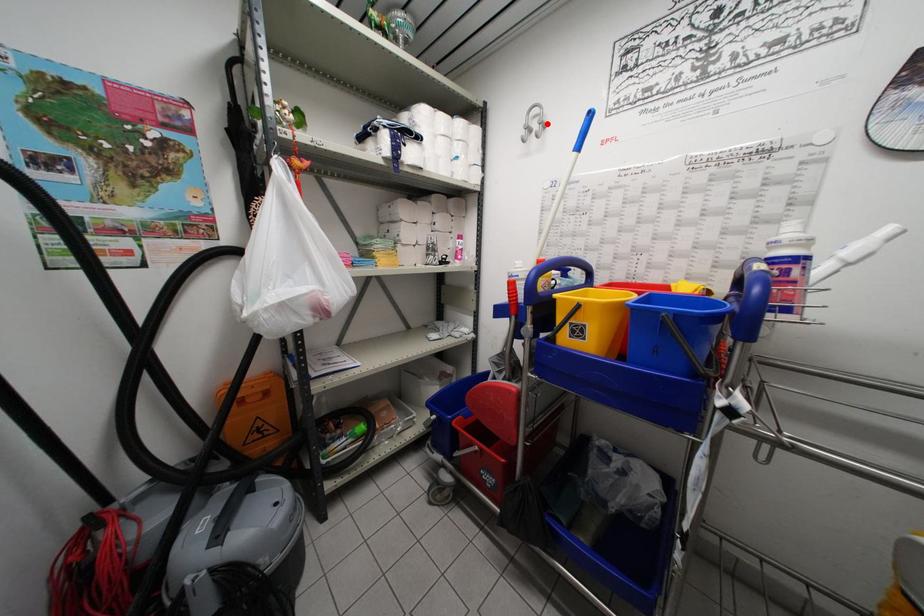
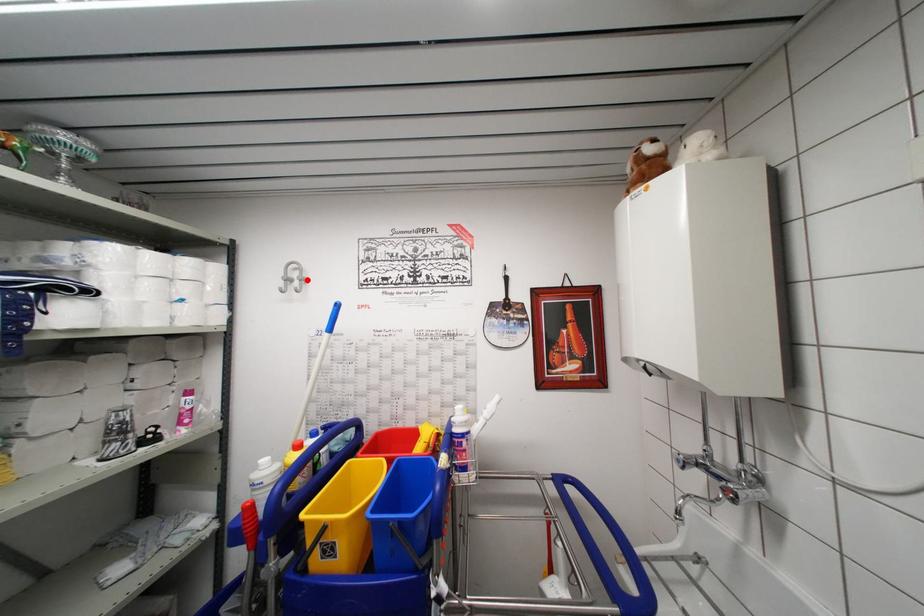
I am providing you with two images of the same scene from different viewpoints. A red point is marked on the first image and another point is marked on the second image. Do the highlighted points in image1 and image2 indicate the same real-world spot?

Yes